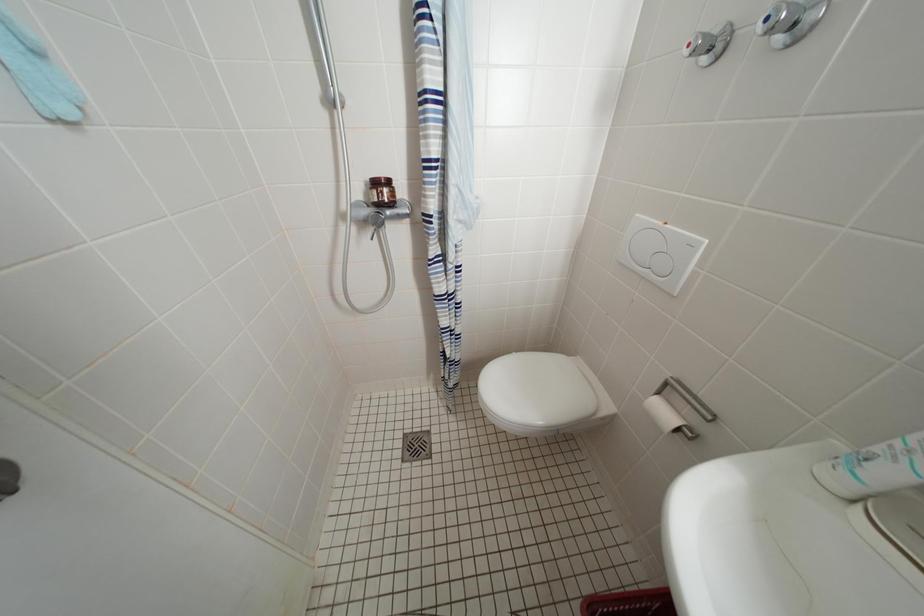
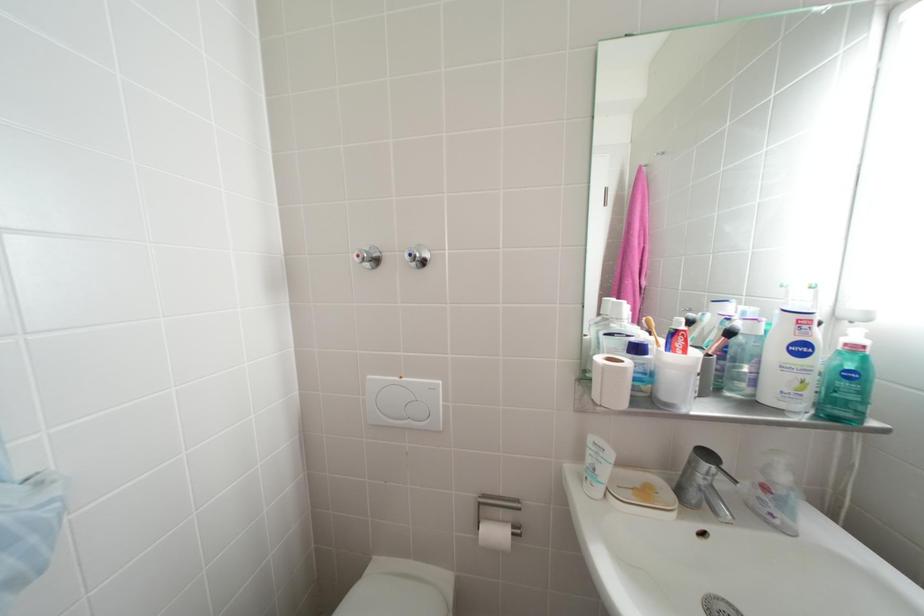
Question: How did the camera likely rotate?

Choices:
 (A) Left
 (B) Right
 (C) Up
 (D) Down

Answer: (B)